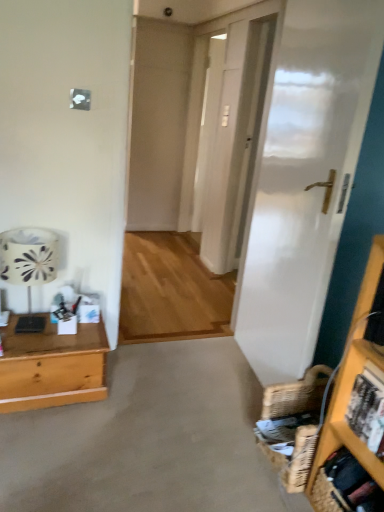
Question: Is wooden desk at left completely or partially inside transparent glass door at center?

Choices:
 (A) no
 (B) yes

Answer: (A)

Question: Considering the relative sizes of transparent glass door at center and wooden desk at left in the image provided, is transparent glass door at center thinner than wooden desk at left?

Choices:
 (A) yes
 (B) no

Answer: (A)

Question: Does transparent glass door at center have a greater width compared to wooden desk at left?

Choices:
 (A) no
 (B) yes

Answer: (A)

Question: Can you confirm if transparent glass door at center is taller than wooden desk at left?

Choices:
 (A) no
 (B) yes

Answer: (B)

Question: Is transparent glass door at center further to camera compared to wooden desk at left?

Choices:
 (A) no
 (B) yes

Answer: (B)

Question: From their relative heights in the image, would you say beige carpet at lower center is taller or shorter than wooden desk at left?

Choices:
 (A) tall
 (B) short

Answer: (B)

Question: Looking at their shapes, would you say beige carpet at lower center is wider or thinner than wooden desk at left?

Choices:
 (A) thin
 (B) wide

Answer: (B)

Question: Considering their positions, is beige carpet at lower center located in front of or behind wooden desk at left?

Choices:
 (A) behind
 (B) front

Answer: (B)

Question: In terms of size, does beige carpet at lower center appear bigger or smaller than wooden desk at left?

Choices:
 (A) small
 (B) big

Answer: (B)

Question: From the image's perspective, relative to woven brown basket at lower right, is wooden desk at left above or below?

Choices:
 (A) below
 (B) above

Answer: (B)

Question: From a real-world perspective, is wooden desk at left positioned above or below woven brown basket at lower right?

Choices:
 (A) below
 (B) above

Answer: (A)

Question: Considering the positions of wooden desk at left and woven brown basket at lower right in the image, is wooden desk at left wider or thinner than woven brown basket at lower right?

Choices:
 (A) wide
 (B) thin

Answer: (B)

Question: In terms of size, does wooden desk at left appear bigger or smaller than woven brown basket at lower right?

Choices:
 (A) small
 (B) big

Answer: (B)

Question: Considering the positions of point (8, 254) and point (61, 370), is point (8, 254) closer or farther from the camera than point (61, 370)?

Choices:
 (A) closer
 (B) farther

Answer: (A)

Question: Based on their positions, is white fabric lampshade at left located to the left or right of wooden desk at left?

Choices:
 (A) right
 (B) left

Answer: (B)